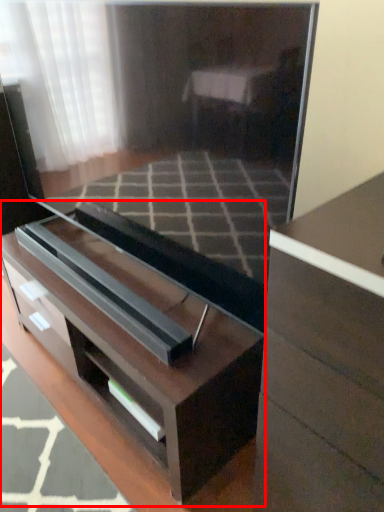
Question: From the image's perspective, where is chest of drawers (annotated by the red box) located in relation to chest of drawers in the image?

Choices:
 (A) below
 (B) above

Answer: (B)